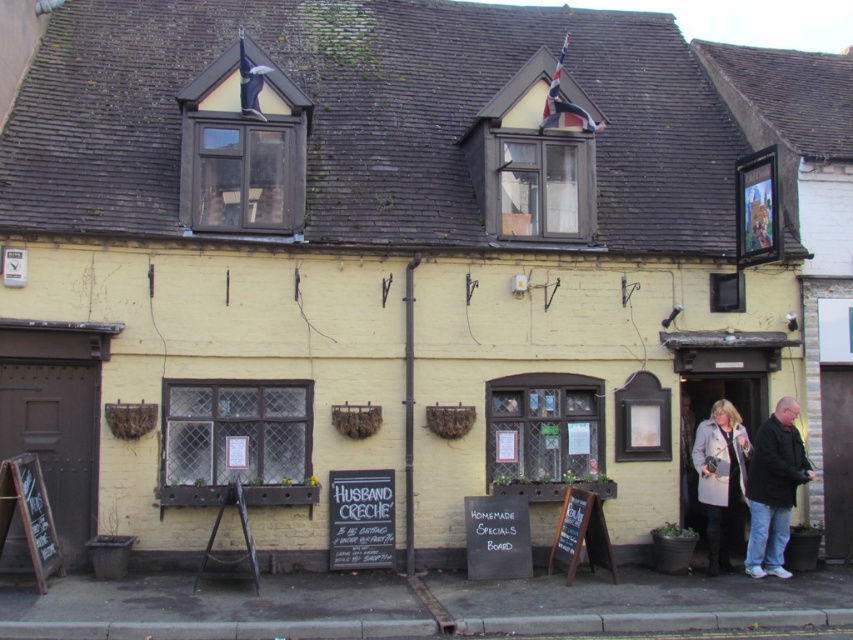
Which is below, leather jacket at lower right or wooden chalkboard at lower left?

wooden chalkboard at lower left is below.

Which is behind, point (792, 417) or point (42, 497)?

The point (792, 417) is behind.

The height and width of the screenshot is (640, 853). What do you see at coordinates (753, 477) in the screenshot?
I see `leather jacket at lower right` at bounding box center [753, 477].

Where is `leather jacket at lower right`? Image resolution: width=853 pixels, height=640 pixels. leather jacket at lower right is located at coordinates (753, 477).

Is gray wool coat at lower right above wooden chalkboard at lower left?

Yes, gray wool coat at lower right is above wooden chalkboard at lower left.

The width and height of the screenshot is (853, 640). Describe the element at coordinates (718, 476) in the screenshot. I see `gray wool coat at lower right` at that location.

You are a GUI agent. You are given a task and a screenshot of the screen. Output one action in this format:
    pyautogui.click(x=<x>, y=<y>)
    Task: Click on the gray wool coat at lower right
    The width and height of the screenshot is (853, 640).
    Given the screenshot: What is the action you would take?
    pyautogui.click(x=718, y=476)

Which of these two, leather jacket at lower right or gray wool coat at lower right, stands shorter?

gray wool coat at lower right is shorter.

Is leather jacket at lower right to the left of gray wool coat at lower right from the viewer's perspective?

In fact, leather jacket at lower right is to the right of gray wool coat at lower right.

Who is more distant from viewer, (721, 481) or (724, 408)?

Positioned behind is point (724, 408).

Locate an element on the screen. The height and width of the screenshot is (640, 853). leather jacket at lower right is located at coordinates (753, 477).